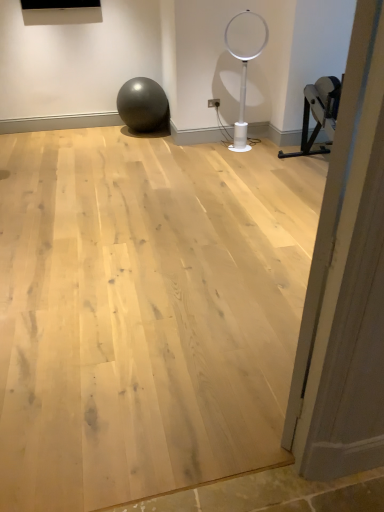
Question: Is white plastic basketball hoop at center facing away from wooden door at right?

Choices:
 (A) yes
 (B) no

Answer: (B)

Question: Is white plastic basketball hoop at center to the left of wooden door at right from the viewer's perspective?

Choices:
 (A) no
 (B) yes

Answer: (A)

Question: Is white plastic basketball hoop at center thinner than wooden door at right?

Choices:
 (A) yes
 (B) no

Answer: (B)

Question: Considering the relative sizes of white plastic basketball hoop at center and wooden door at right in the image provided, is white plastic basketball hoop at center shorter than wooden door at right?

Choices:
 (A) no
 (B) yes

Answer: (B)

Question: Can you confirm if white plastic basketball hoop at center is taller than wooden door at right?

Choices:
 (A) no
 (B) yes

Answer: (A)

Question: Is white plastic basketball hoop at center with wooden door at right?

Choices:
 (A) yes
 (B) no

Answer: (B)

Question: Considering the relative sizes of wooden door at right and matte gray ball at center in the image provided, is wooden door at right smaller than matte gray ball at center?

Choices:
 (A) yes
 (B) no

Answer: (A)

Question: Does wooden door at right appear on the right side of matte gray ball at center?

Choices:
 (A) no
 (B) yes

Answer: (B)

Question: Is wooden door at right shorter than matte gray ball at center?

Choices:
 (A) no
 (B) yes

Answer: (A)

Question: From a real-world perspective, does wooden door at right sit lower than matte gray ball at center?

Choices:
 (A) no
 (B) yes

Answer: (A)

Question: Could you tell me if wooden door at right is turned towards matte gray ball at center?

Choices:
 (A) yes
 (B) no

Answer: (B)

Question: Considering the relative sizes of wooden door at right and matte gray ball at center in the image provided, is wooden door at right thinner than matte gray ball at center?

Choices:
 (A) no
 (B) yes

Answer: (B)

Question: Would you consider white plastic basketball hoop at center to be distant from natural wood floor at center?

Choices:
 (A) yes
 (B) no

Answer: (A)